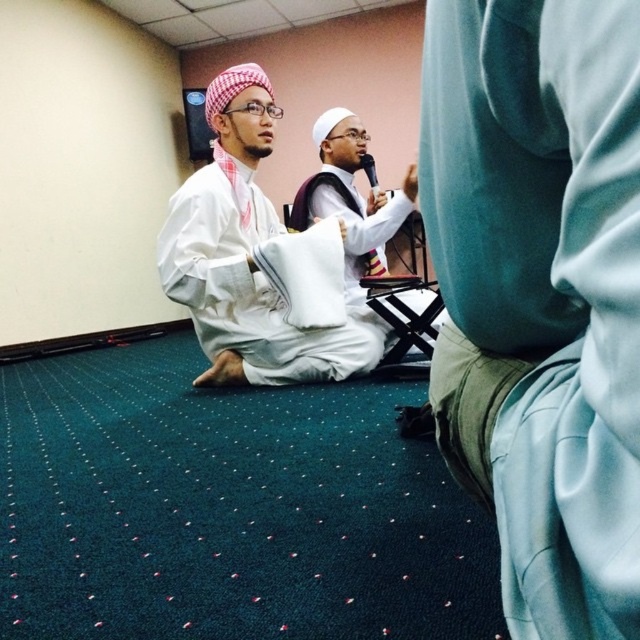
You are standing in the room and want to place a small plant between the two points, point [216,230] and point [364,220]. Which point should the plant be closer to in order to be placed at the same depth as the person on the left?

The plant should be closer to point [216,230] because it is closer to the camera than point [364,220], aligning with the depth of the person on the left.

In the scene, there are two people wearing white cotton robe at center and white matte shirt at center. Which one is positioned to the left?

The white cotton robe at center is to the left of the white matte shirt at center.

You are organizing a small event and need to choose between the white cotton robe at center and the white matte shirt at center for a speaker. Considering their sizes, which one would be more appropriate for a speaker who prefers a more relaxed and comfortable fit?

The white cotton robe at center is more appropriate because its width is larger than the white matte shirt at center, providing a more relaxed and comfortable fit for the speaker.